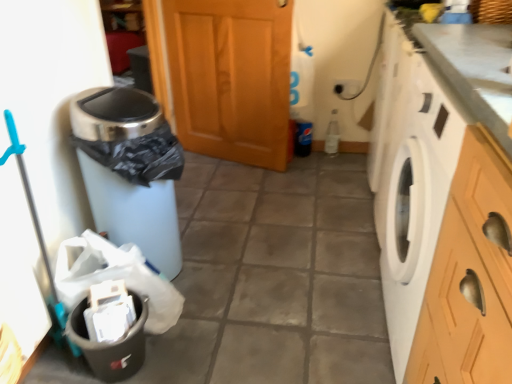
Question: Is white glossy washing machine at right shorter than matte plastic trash can at left?

Choices:
 (A) no
 (B) yes

Answer: (A)

Question: Is white glossy washing machine at right smaller than matte plastic trash can at left?

Choices:
 (A) no
 (B) yes

Answer: (A)

Question: From the image's perspective, would you say white glossy washing machine at right is positioned over matte plastic trash can at left?

Choices:
 (A) yes
 (B) no

Answer: (B)

Question: Can we say white glossy washing machine at right lies outside matte plastic trash can at left?

Choices:
 (A) no
 (B) yes

Answer: (B)

Question: Is white glossy washing machine at right thinner than matte plastic trash can at left?

Choices:
 (A) yes
 (B) no

Answer: (A)

Question: From a real-world perspective, is matte plastic trash can at left above or below black plastic trash can at left?

Choices:
 (A) above
 (B) below

Answer: (A)

Question: Would you say matte plastic trash can at left is inside or outside black plastic trash can at left?

Choices:
 (A) outside
 (B) inside

Answer: (A)

Question: Looking at the image, does matte plastic trash can at left seem bigger or smaller compared to black plastic trash can at left?

Choices:
 (A) big
 (B) small

Answer: (A)

Question: In terms of width, does matte plastic trash can at left look wider or thinner when compared to black plastic trash can at left?

Choices:
 (A) wide
 (B) thin

Answer: (A)

Question: Visually, is wooden door at center positioned to the left or to the right of white glossy washing machine at right?

Choices:
 (A) right
 (B) left

Answer: (B)

Question: Considering the positions of wooden door at center and white glossy washing machine at right in the image, is wooden door at center wider or thinner than white glossy washing machine at right?

Choices:
 (A) thin
 (B) wide

Answer: (A)

Question: In terms of size, does wooden door at center appear bigger or smaller than white glossy washing machine at right?

Choices:
 (A) small
 (B) big

Answer: (A)

Question: Do you think wooden door at center is within white glossy washing machine at right, or outside of it?

Choices:
 (A) inside
 (B) outside

Answer: (B)

Question: Based on their sizes in the image, would you say black plastic trash can at left is bigger or smaller than wooden door at center?

Choices:
 (A) small
 (B) big

Answer: (A)

Question: Relative to wooden door at center, is black plastic trash can at left in front or behind?

Choices:
 (A) front
 (B) behind

Answer: (A)